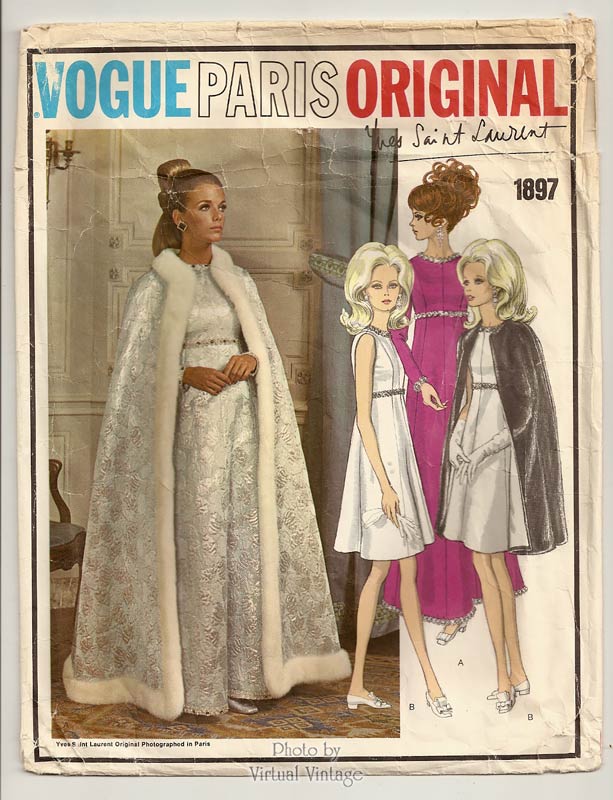
You are a GUI agent. You are given a task and a screenshot of the screen. Output one action in this format:
    pyautogui.click(x=<x>, y=<y>)
    Task: Click on the curtain
    The height and width of the screenshot is (800, 613).
    Given the screenshot: What is the action you would take?
    pyautogui.click(x=349, y=158), pyautogui.click(x=341, y=386), pyautogui.click(x=328, y=262)